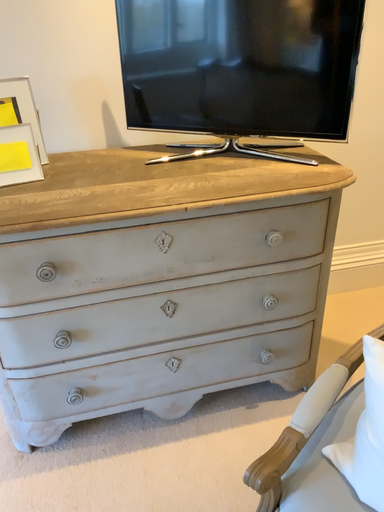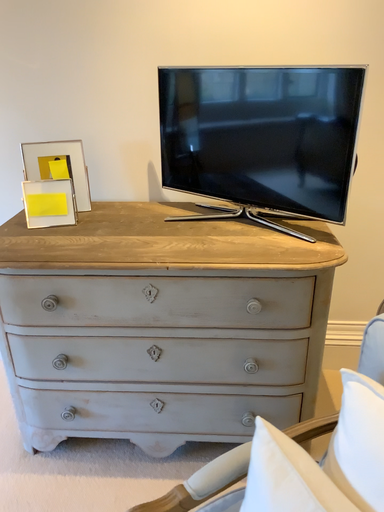
Question: How did the camera likely rotate when shooting the video?

Choices:
 (A) rotated right
 (B) rotated left

Answer: (B)